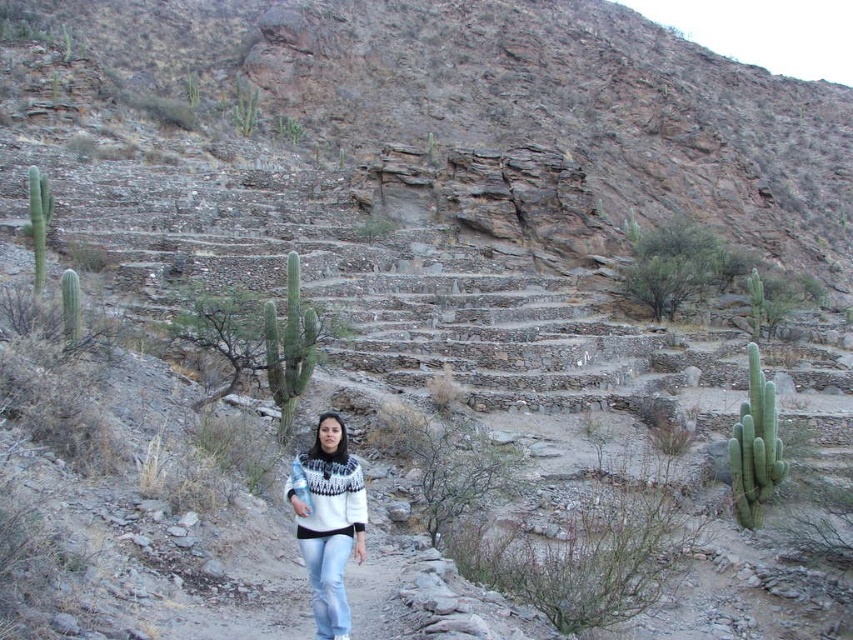
You are a hiker navigating the rugged terrain in the image. You spot two points marked on your map at coordinates point (x=573, y=26) and point (x=341, y=560). Which point is closer to your current position?

Point (x=573, y=26) is closer to your current position because it is further to the viewer than point (x=341, y=560).

You are a hiker trying to navigate through the arid landscape. You notice the white knitwear at center and the green spiny cactus at left. Which object takes up more space in the scene?

The green spiny cactus at left takes up more space in the scene than the white knitwear at center because the white knitwear at center occupies less space than green spiny cactus at left.